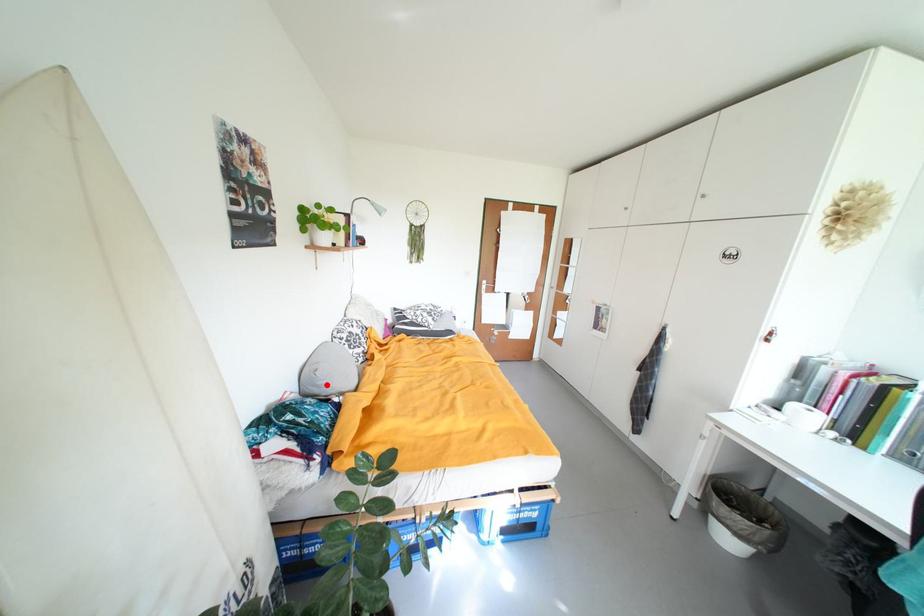
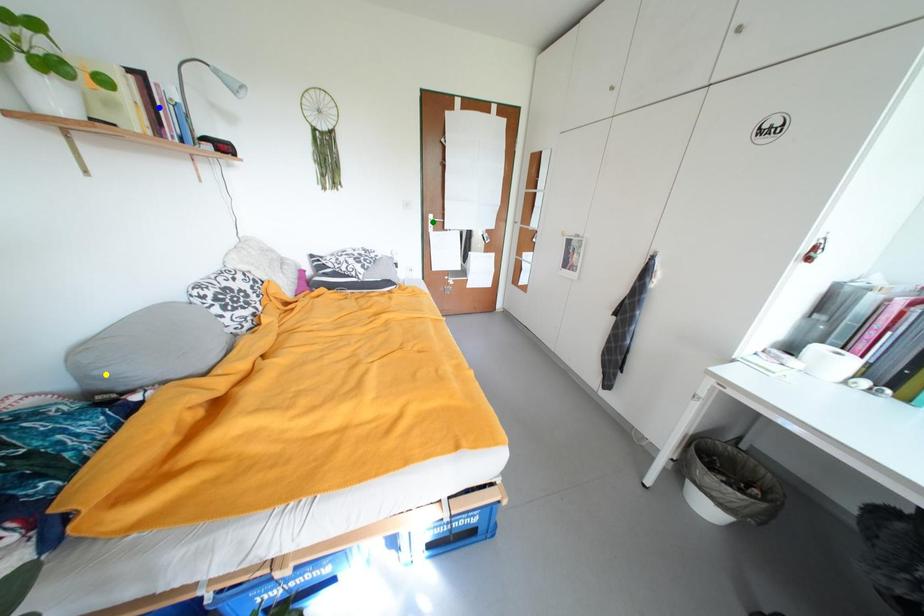
Question: I am providing you with two images of the same scene from different viewpoints. A red point is marked on the first image. You are given multiple points on the second image. Can you choose the point in image 2 that corresponds to the point in image 1?

Choices:
 (A) yellow point
 (B) green point
 (C) blue point

Answer: (A)